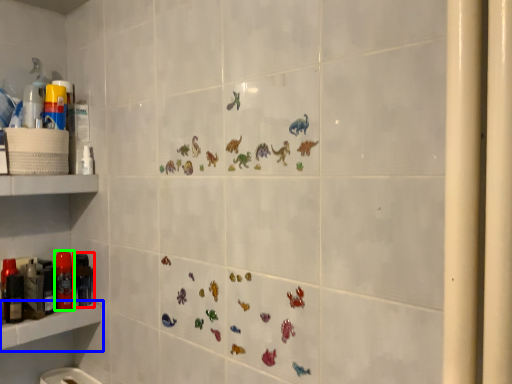
Question: Which is nearer to the toiletry (highlighted by a red box)? shelf (highlighted by a blue box) or toiletry (highlighted by a green box).

Choices:
 (A) shelf
 (B) toiletry

Answer: (B)